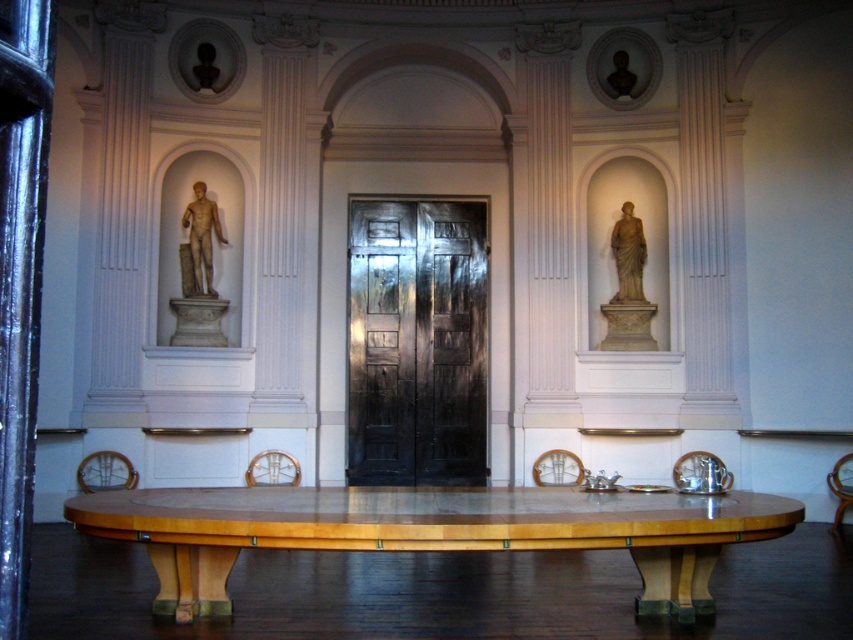
Does light wood table at center have a greater height compared to marble statue at left?

No.

Can you confirm if light wood table at center is positioned to the left of marble statue at left?

No, light wood table at center is not to the left of marble statue at left.

Where is `light wood table at center`? light wood table at center is located at coordinates (428, 531).

I want to click on light wood table at center, so [x=428, y=531].

Is point (577, 486) more distant than point (358, 228)?

No, (577, 486) is closer to viewer.

Does light wood table at center have a lesser width compared to black polished wood door at center?

In fact, light wood table at center might be wider than black polished wood door at center.

Does point (184, 538) come closer to viewer compared to point (416, 380)?

Yes, it is in front of point (416, 380).

In order to click on light wood table at center in this screenshot , I will do `click(428, 531)`.

Which is more to the left, black polished wood door at center or matte gray statue at right?

Positioned to the left is black polished wood door at center.

Is point (402, 428) positioned behind point (636, 291)?

Yes, point (402, 428) is farther from viewer.

Which is in front, point (444, 253) or point (631, 209)?

Positioned in front is point (631, 209).

Image resolution: width=853 pixels, height=640 pixels. In order to click on black polished wood door at center in this screenshot , I will do `click(416, 342)`.